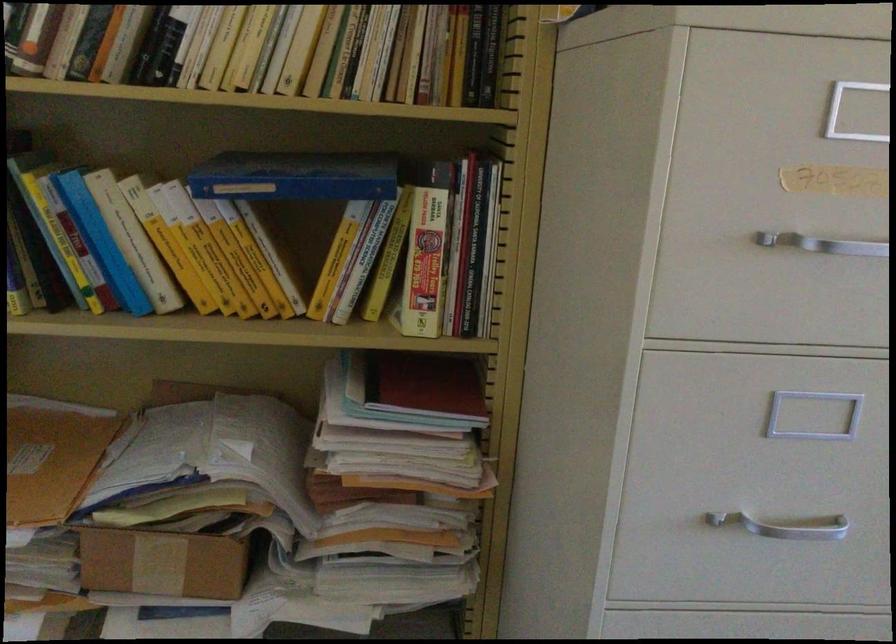
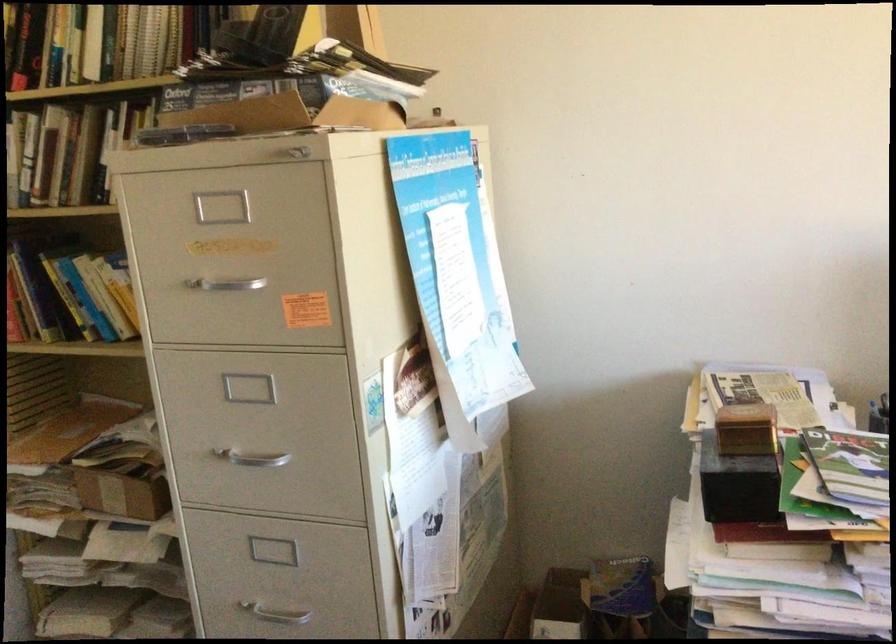
Where in the second image is the point corresponding to [805,243] from the first image?

(224, 283)